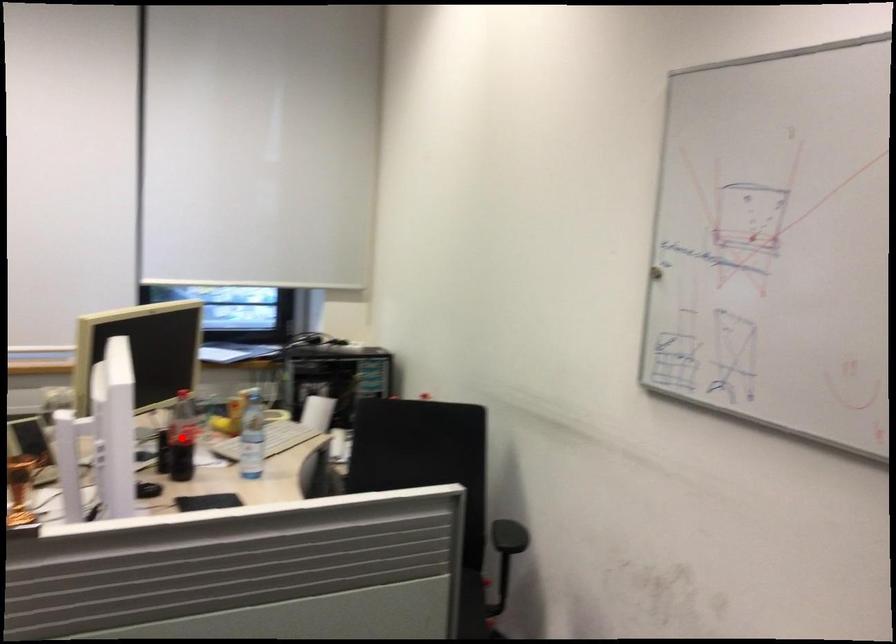
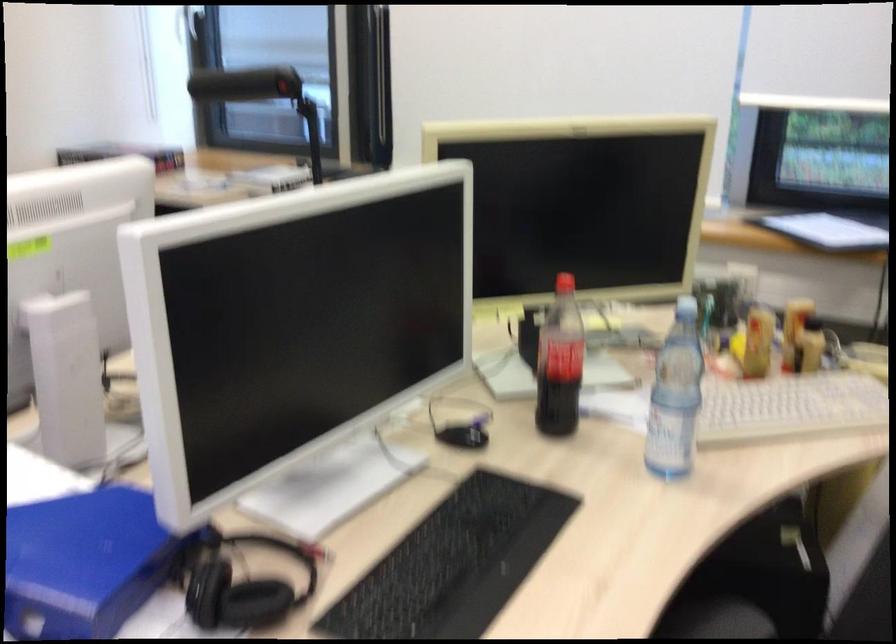
Question: A red point is marked in image1. In image2, is the corresponding 3D point closer to the camera or farther? Reply with the corresponding letter.

Choices:
 (A) The corresponding 3D point is closer.
 (B) The corresponding 3D point is farther.

Answer: (A)